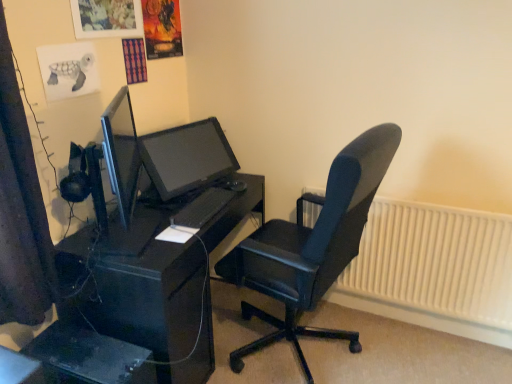
Find the location of a particular element. The image size is (512, 384). free spot below white plastic radiator at right (from a real-world perspective) is located at coordinates (395, 319).